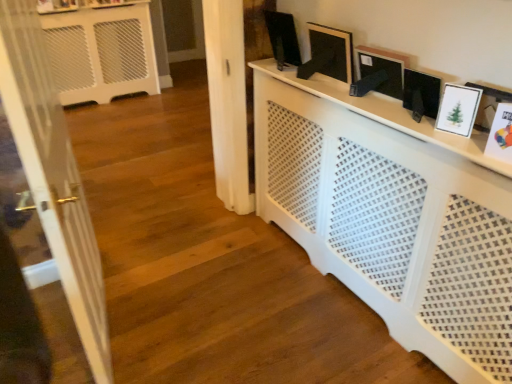
Question: Could white matte picture frame at upper right, which is the 3th picture frame in left-to-right order, be considered to be inside matte black picture frame at upper center, acting as the 5th picture frame starting from the front?

Choices:
 (A) no
 (B) yes

Answer: (A)

Question: Is matte black picture frame at upper center, acting as the 1th picture frame starting from the back, further to the viewer compared to white matte picture frame at upper right, the 3th picture frame positioned from the back?

Choices:
 (A) yes
 (B) no

Answer: (A)

Question: Can you confirm if matte black picture frame at upper center, acting as the 1th picture frame starting from the back, is shorter than white matte picture frame at upper right, the 3th picture frame when ordered from right to left?

Choices:
 (A) no
 (B) yes

Answer: (A)

Question: Is matte black picture frame at upper center, the first picture frame when ordered from left to right, positioned with its back to white matte picture frame at upper right, the 3th picture frame positioned from the back?

Choices:
 (A) no
 (B) yes

Answer: (A)

Question: Is matte black picture frame at upper center, the first picture frame when ordered from left to right, positioned beyond the bounds of white matte picture frame at upper right, the 3th picture frame positioned from the back?

Choices:
 (A) yes
 (B) no

Answer: (A)

Question: Is matte black picture frame at upper center, acting as the 1th picture frame starting from the back, oriented towards white matte picture frame at upper right, which is the 3th picture frame from front to back?

Choices:
 (A) yes
 (B) no

Answer: (B)

Question: Is white glossy door at left further to the viewer compared to white matte picture frame at upper right, the 3th picture frame positioned from the back?

Choices:
 (A) yes
 (B) no

Answer: (B)

Question: Is white glossy door at left bigger than white matte picture frame at upper right, the 3th picture frame when ordered from right to left?

Choices:
 (A) no
 (B) yes

Answer: (B)

Question: From a real-world perspective, is white glossy door at left positioned under white matte picture frame at upper right, which is the 3th picture frame in left-to-right order, based on gravity?

Choices:
 (A) yes
 (B) no

Answer: (A)

Question: Is white glossy door at left smaller than white matte picture frame at upper right, the 3th picture frame when ordered from right to left?

Choices:
 (A) yes
 (B) no

Answer: (B)

Question: Is white glossy door at left positioned beyond the bounds of white matte picture frame at upper right, which is the 3th picture frame from front to back?

Choices:
 (A) no
 (B) yes

Answer: (B)

Question: Are white glossy door at left and white matte picture frame at upper right, which is the 3th picture frame in left-to-right order, beside each other?

Choices:
 (A) no
 (B) yes

Answer: (A)

Question: Is white glossy picture frame at upper right, which is the 2th picture frame from front to back, with white paper picture frame at right, which is the fifth picture frame from back to front?

Choices:
 (A) yes
 (B) no

Answer: (B)